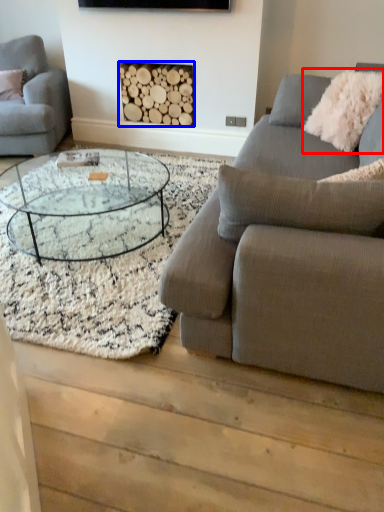
Question: Which object appears farthest to the camera in this image, pillow (highlighted by a red box) or fireplace (highlighted by a blue box)?

Choices:
 (A) pillow
 (B) fireplace

Answer: (B)